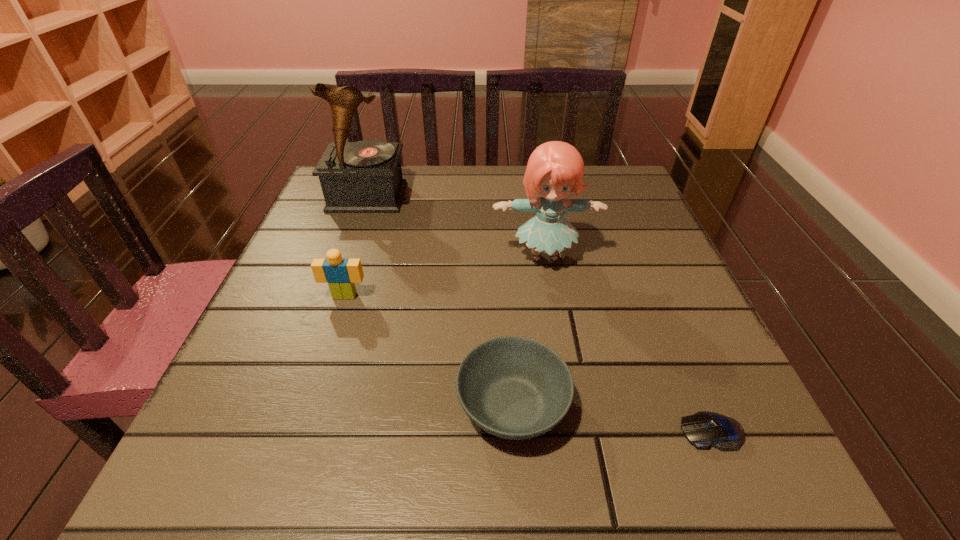
Locate an element on the screen. The width and height of the screenshot is (960, 540). free space between the soup bowl and the third shortest object is located at coordinates (429, 350).

You are a GUI agent. You are given a task and a screenshot of the screen. Output one action in this format:
    pyautogui.click(x=<x>, y=<y>)
    Task: Click on the unoccupied area between the fourth tallest object and the fourth nearest object
    
    Given the screenshot: What is the action you would take?
    pyautogui.click(x=529, y=331)

The height and width of the screenshot is (540, 960). Find the location of `vacant area that lies between the phonograph_record and the rightmost object`. vacant area that lies between the phonograph_record and the rightmost object is located at coordinates (540, 314).

Image resolution: width=960 pixels, height=540 pixels. What are the coordinates of `vacant space that is in between the Lego and the farthest object` in the screenshot? It's located at (356, 246).

Find the location of a particular element. Image resolution: width=960 pixels, height=540 pixels. empty space that is in between the doll and the Lego is located at coordinates (444, 276).

At what (x,y) coordinates should I click in order to perform the action: click on vacant area between the Lego and the soup bowl. Please return your answer as a coordinate pair (x, y). Looking at the image, I should click on (429, 350).

The width and height of the screenshot is (960, 540). I want to click on free point between the Lego and the second farthest object, so click(444, 276).

Where is `vacant area between the second farthest object and the phonograph_record`? The image size is (960, 540). vacant area between the second farthest object and the phonograph_record is located at coordinates (456, 227).

Locate an element on the screen. This screenshot has height=540, width=960. vacant area between the fourth nearest object and the farthest object is located at coordinates (456, 227).

Identify which object is located as the nearest to the shortest object. Please provide its 2D coordinates. Your answer should be formatted as a tuple, i.e. [(x, y)], where the tuple contains the x and y coordinates of a point satisfying the conditions above.

[(513, 387)]